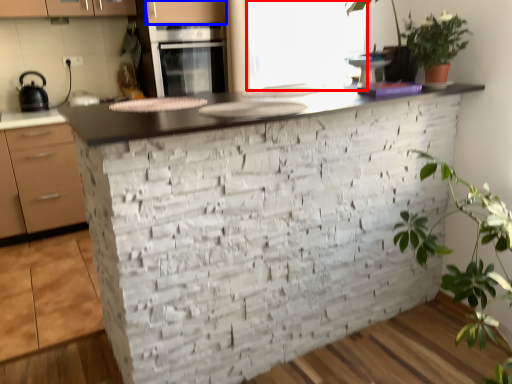
Question: Which of the following is the farthest to the observer, window screen (highlighted by a red box) or cabinetry (highlighted by a blue box)?

Choices:
 (A) window screen
 (B) cabinetry

Answer: (B)